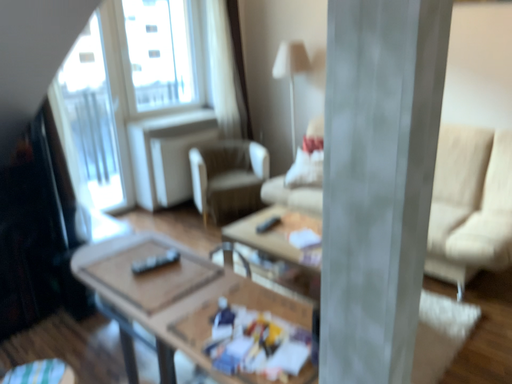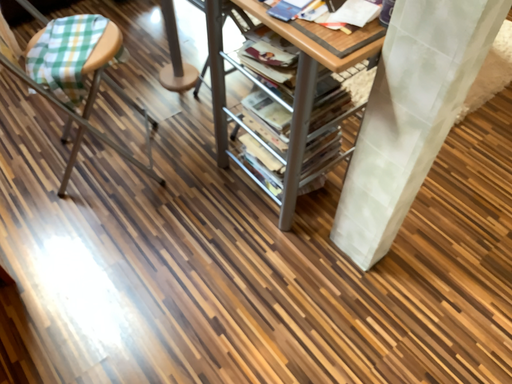
Question: How did the camera likely rotate when shooting the video?

Choices:
 (A) rotated upward
 (B) rotated downward

Answer: (B)